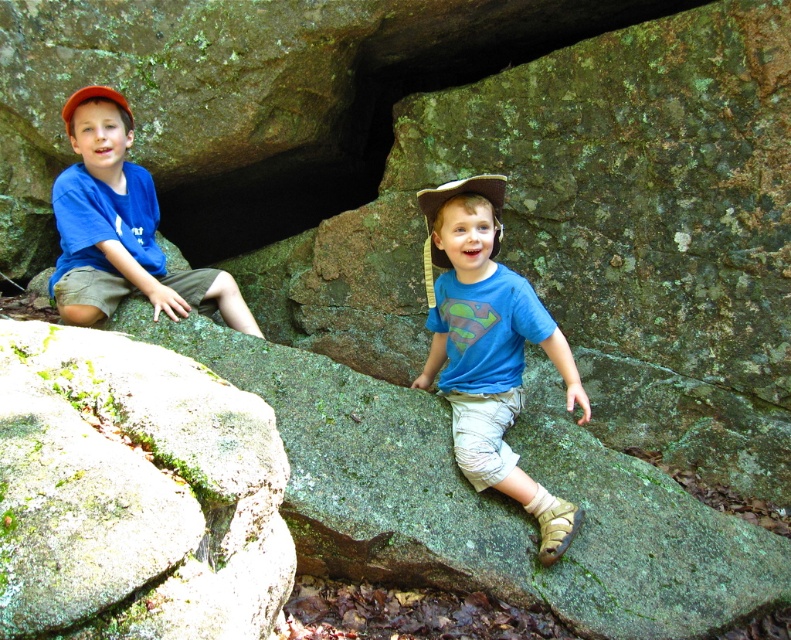
Who is more forward, (80,227) or (502,182)?

Positioned in front is point (502,182).

Who is more distant from viewer, (63,285) or (426,244)?

The point (426,244) is more distant.

Does point (120, 208) lie in front of point (460, 189)?

No, (120, 208) is behind (460, 189).

You are a GUI agent. You are given a task and a screenshot of the screen. Output one action in this format:
    pyautogui.click(x=<x>, y=<y>)
    Task: Click on the matte blue shirt at left
    Image resolution: width=791 pixels, height=640 pixels.
    Given the screenshot: What is the action you would take?
    pyautogui.click(x=120, y=227)

Does green mossy rock at lower left have a lesser height compared to blue cotton shirt at center?

Yes, green mossy rock at lower left is shorter than blue cotton shirt at center.

Does green mossy rock at lower left have a lesser width compared to blue cotton shirt at center?

No, green mossy rock at lower left is not thinner than blue cotton shirt at center.

Identify the location of green mossy rock at lower left. (133, 492).

The width and height of the screenshot is (791, 640). What are the coordinates of `green mossy rock at lower left` in the screenshot? It's located at pyautogui.click(x=133, y=492).

Which is behind, point (464, 180) or point (93, 93)?

Positioned behind is point (93, 93).

Where is `brown leather baseball hat at center`? This screenshot has width=791, height=640. brown leather baseball hat at center is located at coordinates (445, 202).